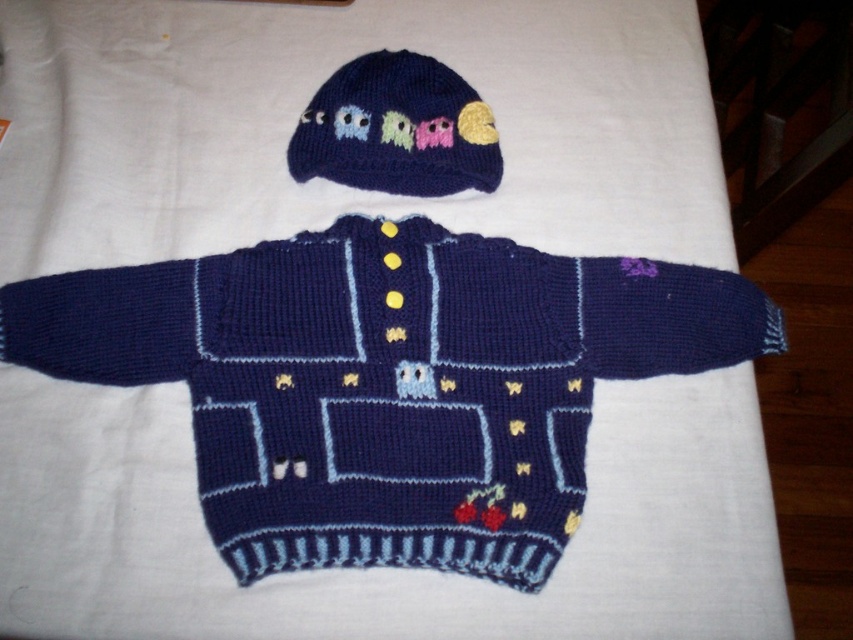
You are organizing a charity clothing drive and need to pack items into boxes. You have a navy blue knitted sweater at center and a knitted dark blue hat at upper center. The box you are using has limited vertical space. Which item should you place first to maximize space efficiency?

The navy blue knitted sweater at center is much taller than the knitted dark blue hat at upper center, so you should place the navy blue knitted sweater at center first to utilize the vertical space effectively before placing the smaller hat on top.

You are a tailor who needs to pack the navy blue knitted sweater at center and the knitted dark blue hat at upper center into a storage box. The box can only fit one of the items. Based on their sizes, which item should you choose to store first?

The navy blue knitted sweater at center is larger in size than the knitted dark blue hat at upper center, so you should store the navy blue knitted sweater at center first to ensure it fits in the box before the smaller hat.